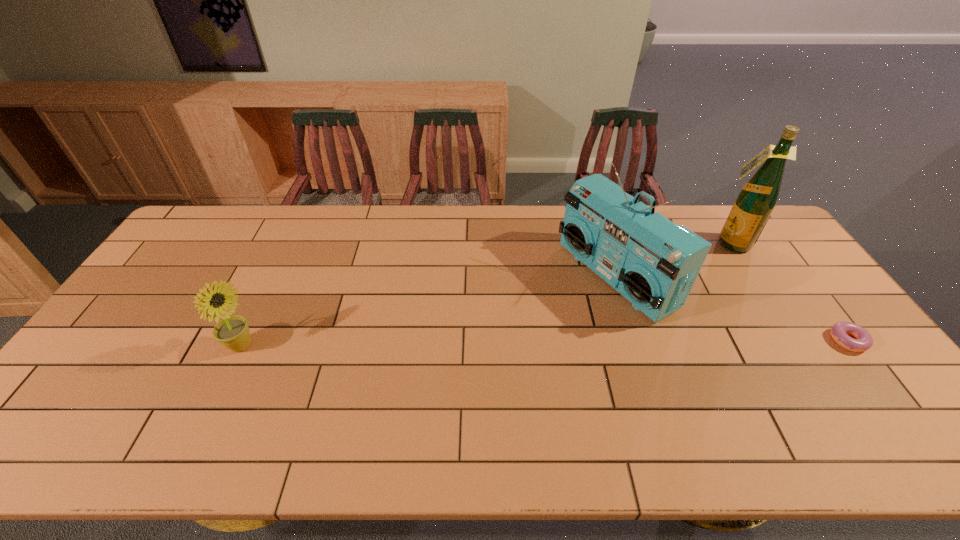
Image resolution: width=960 pixels, height=540 pixels. I want to click on free spot on the desktop that is between the leftmost object and the shortest object and is positioned on the front-facing side of the third shortest object, so click(485, 344).

In order to click on vacant space on the desktop that is between the third tallest object and the doughnut and is positioned on the front-facing side of the second object from right to left in this screenshot , I will do `click(632, 343)`.